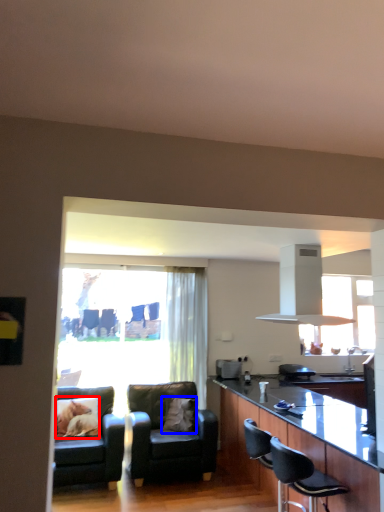
Question: Among these objects, which one is farthest to the camera, pillow (highlighted by a red box) or pillow (highlighted by a blue box)?

Choices:
 (A) pillow
 (B) pillow

Answer: (B)